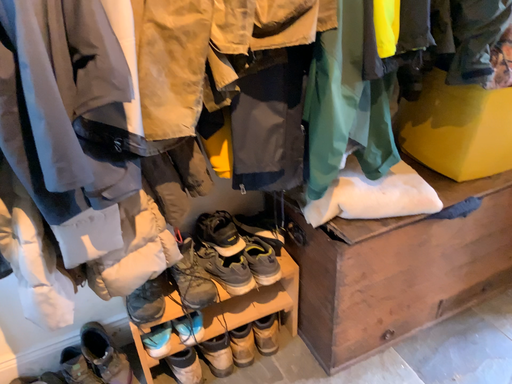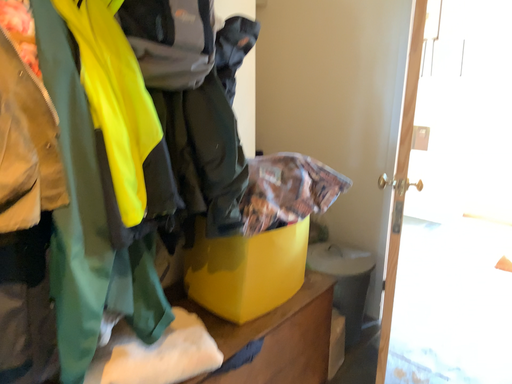
Question: Which way did the camera rotate in the video?

Choices:
 (A) rotated upward
 (B) rotated downward

Answer: (A)